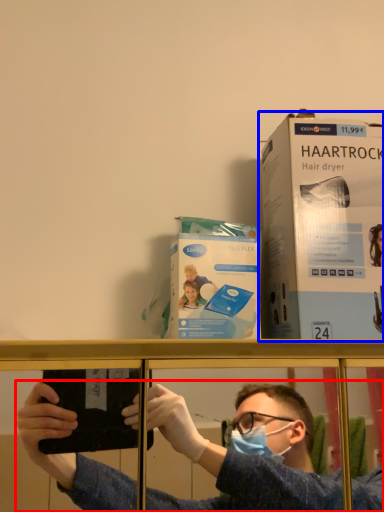
Question: Among these objects, which one is nearest to the camera, person (highlighted by a red box) or paperback book (highlighted by a blue box)?

Choices:
 (A) person
 (B) paperback book

Answer: (A)